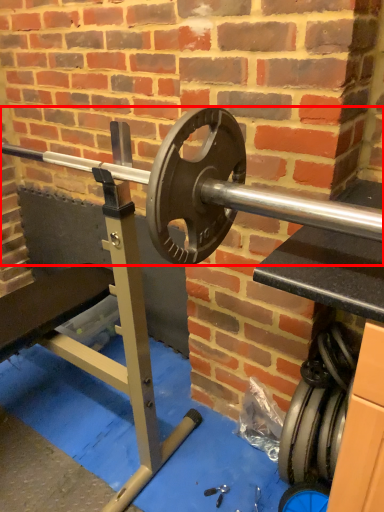
Question: Where is barbell (annotated by the red box) located in relation to tire in the image?

Choices:
 (A) right
 (B) left

Answer: (B)